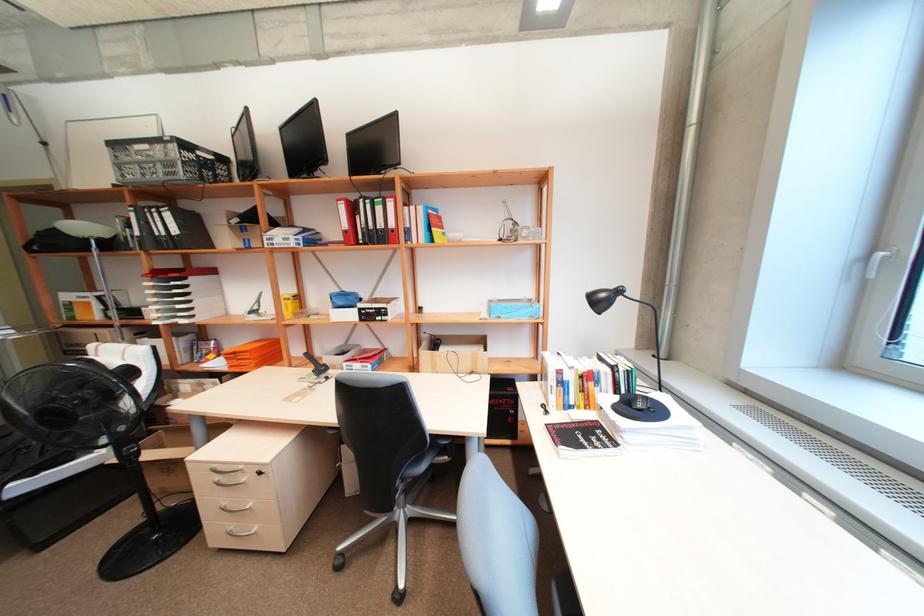
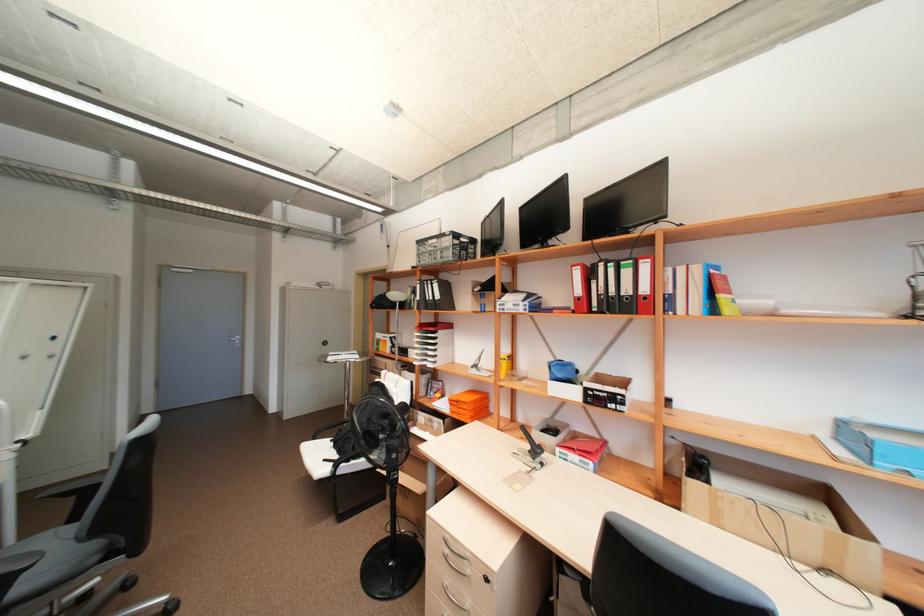
In the second image, find the point that corresponds to [111,148] in the first image.

(420, 246)